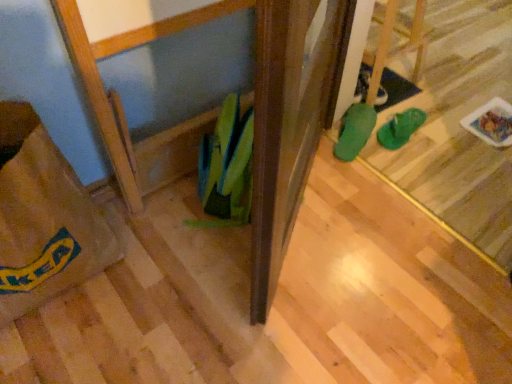
Question: Is brown paper bag at lower left facing away from green rubber boot at center, placed as the first footwear when sorted from left to right?

Choices:
 (A) yes
 (B) no

Answer: (B)

Question: Is brown paper bag at lower left at the left side of green rubber boot at center, placed as the first footwear when sorted from left to right?

Choices:
 (A) no
 (B) yes

Answer: (B)

Question: Is brown paper bag at lower left at the right side of green rubber boot at center, marked as the second footwear in a right-to-left arrangement?

Choices:
 (A) yes
 (B) no

Answer: (B)

Question: Is brown paper bag at lower left not near green rubber boot at center, marked as the second footwear in a right-to-left arrangement?

Choices:
 (A) yes
 (B) no

Answer: (B)

Question: From a real-world perspective, is brown paper bag at lower left physically above green rubber boot at center, placed as the first footwear when sorted from left to right?

Choices:
 (A) no
 (B) yes

Answer: (B)

Question: Is brown paper bag at lower left wider or thinner than green rubber flip-flops at center, the second footwear when ordered from left to right?

Choices:
 (A) wide
 (B) thin

Answer: (A)

Question: From the image's perspective, relative to green rubber flip-flops at center, the first footwear in the right-to-left sequence, is brown paper bag at lower left above or below?

Choices:
 (A) below
 (B) above

Answer: (A)

Question: In terms of height, does brown paper bag at lower left look taller or shorter compared to green rubber flip-flops at center, the second footwear when ordered from left to right?

Choices:
 (A) tall
 (B) short

Answer: (A)

Question: In the image, is brown paper bag at lower left positioned in front of or behind green rubber flip-flops at center, the second footwear when ordered from left to right?

Choices:
 (A) front
 (B) behind

Answer: (A)

Question: Would you say green rubber boot at center, placed as the first footwear when sorted from left to right, is inside or outside brown paper bag at lower left?

Choices:
 (A) outside
 (B) inside

Answer: (A)

Question: Considering the positions of point (362, 112) and point (96, 264), is point (362, 112) closer or farther from the camera than point (96, 264)?

Choices:
 (A) farther
 (B) closer

Answer: (A)

Question: From a real-world perspective, is green rubber boot at center, marked as the second footwear in a right-to-left arrangement, above or below brown paper bag at lower left?

Choices:
 (A) above
 (B) below

Answer: (B)

Question: From the image's perspective, is green rubber boot at center, marked as the second footwear in a right-to-left arrangement, located above or below brown paper bag at lower left?

Choices:
 (A) below
 (B) above

Answer: (B)

Question: From their relative heights in the image, would you say green rubber flip-flops at center, the first footwear in the right-to-left sequence, is taller or shorter than brown paper bag at lower left?

Choices:
 (A) tall
 (B) short

Answer: (B)

Question: From the image's perspective, relative to brown paper bag at lower left, is green rubber flip-flops at center, the first footwear in the right-to-left sequence, above or below?

Choices:
 (A) above
 (B) below

Answer: (A)